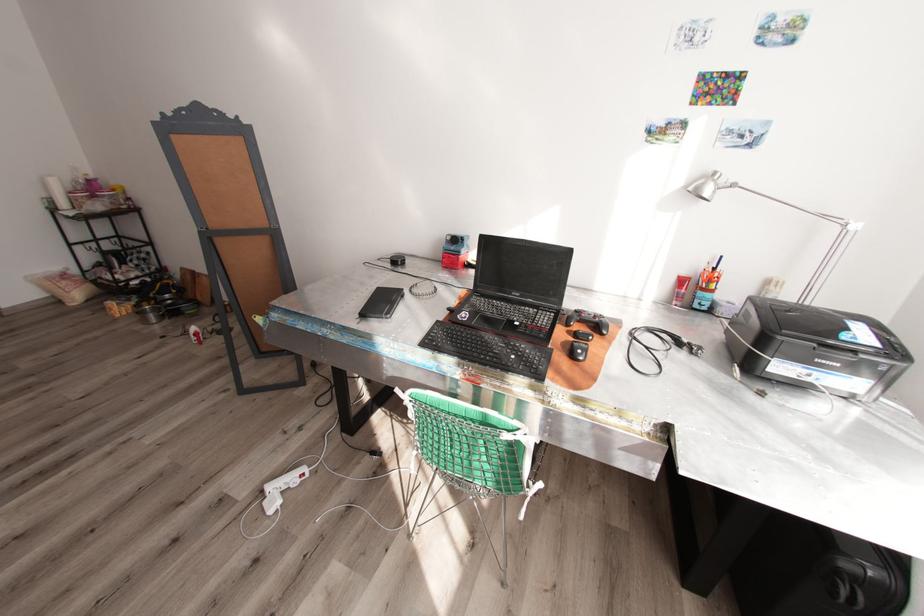
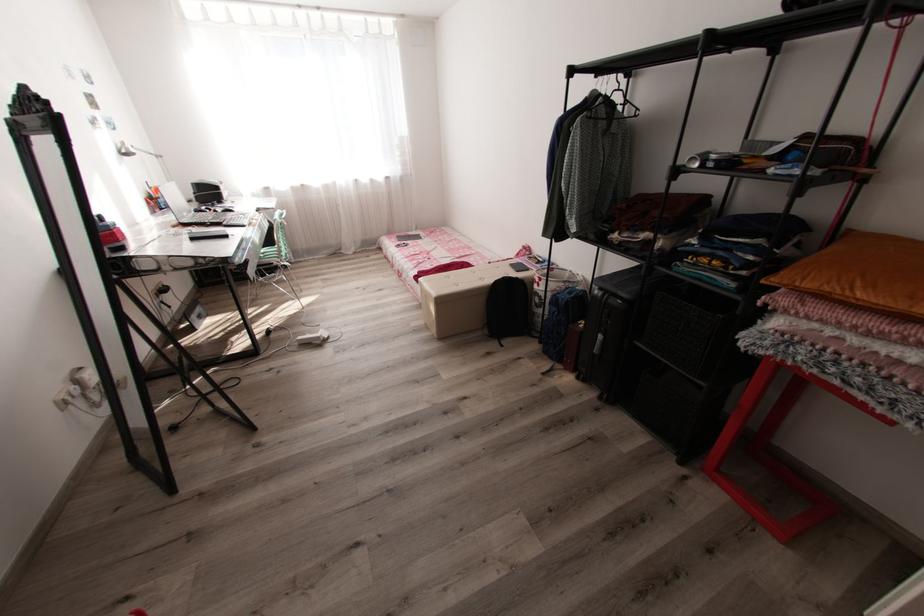
Find the pixel in the second image that matches the point at 699,305 in the first image.

(167, 207)